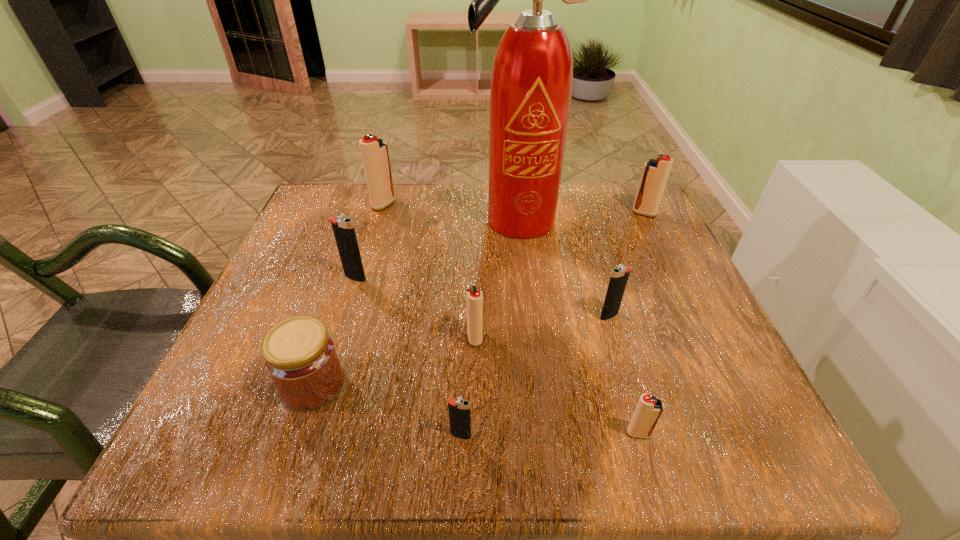
Image resolution: width=960 pixels, height=540 pixels. I want to click on blank area in the image that satisfies the following two spatial constraints: 1. on the front side of the second black igniter from right to left; 2. on the left side of the leftmost black igniter, so click(x=306, y=435).